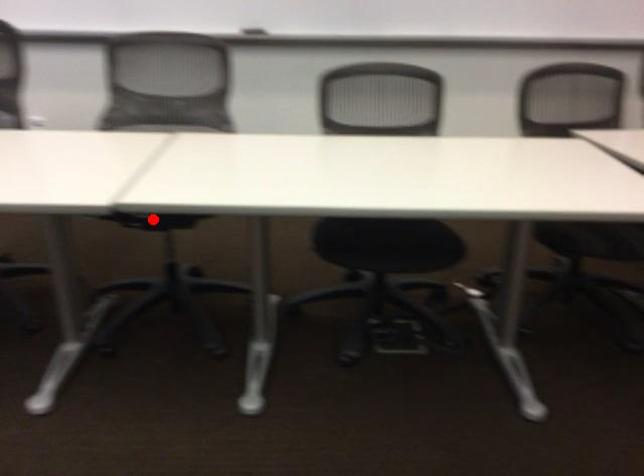
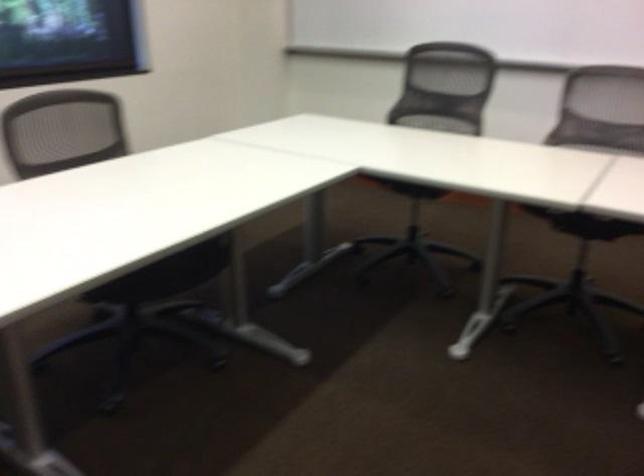
The point at the highlighted location is marked in the first image. Where is the corresponding point in the second image?

(585, 223)